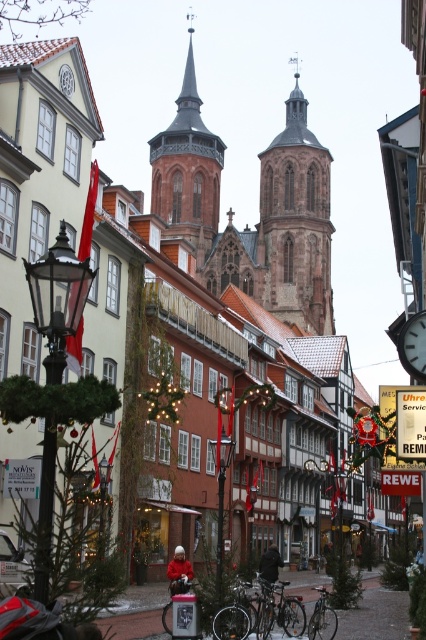
Question: Is reddish-brown stone bell tower at center smaller than metallic clock at center?

Choices:
 (A) yes
 (B) no

Answer: (B)

Question: Which is farther from the brown stone bell tower at center?

Choices:
 (A) reddish-brown stone bell tower at center
 (B) metallic clock at center

Answer: (B)

Question: Can you confirm if brown stone bell tower at center is smaller than metallic clock at center?

Choices:
 (A) yes
 (B) no

Answer: (B)

Question: Which point is farther to the camera?

Choices:
 (A) (399, 355)
 (B) (158, 177)
 (C) (273, 156)

Answer: (B)

Question: Which object is positioned closest to the brown stone bell tower at center?

Choices:
 (A) metallic clock at center
 (B) reddish-brown stone bell tower at center

Answer: (B)

Question: Can you confirm if reddish-brown stone bell tower at center is bigger than metallic clock at center?

Choices:
 (A) no
 (B) yes

Answer: (B)